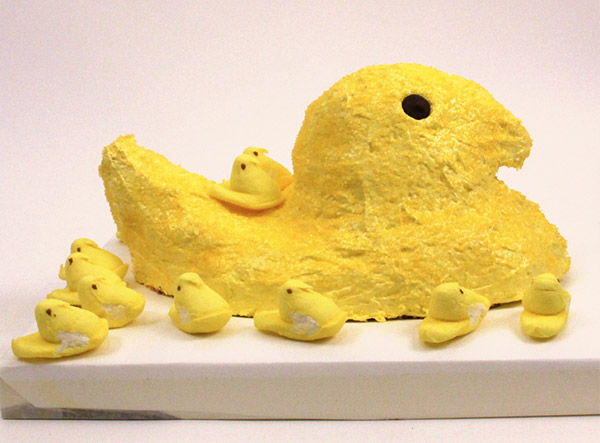
You are a GUI agent. You are given a task and a screenshot of the screen. Output one action in this format:
    pyautogui.click(x=<x>, y=<y>)
    Task: Click on the display stand
    The height and width of the screenshot is (443, 600).
    Given the screenshot: What is the action you would take?
    pyautogui.click(x=262, y=388)